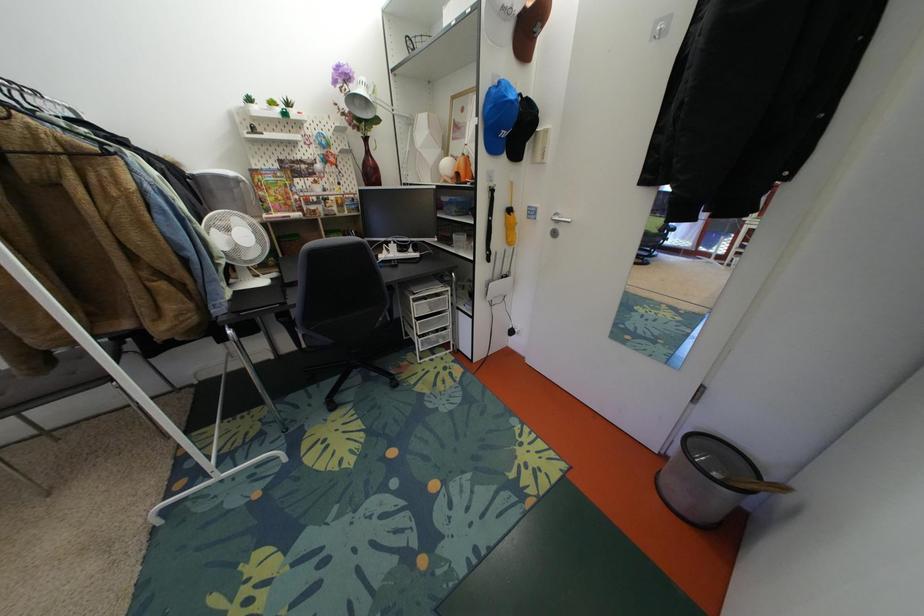
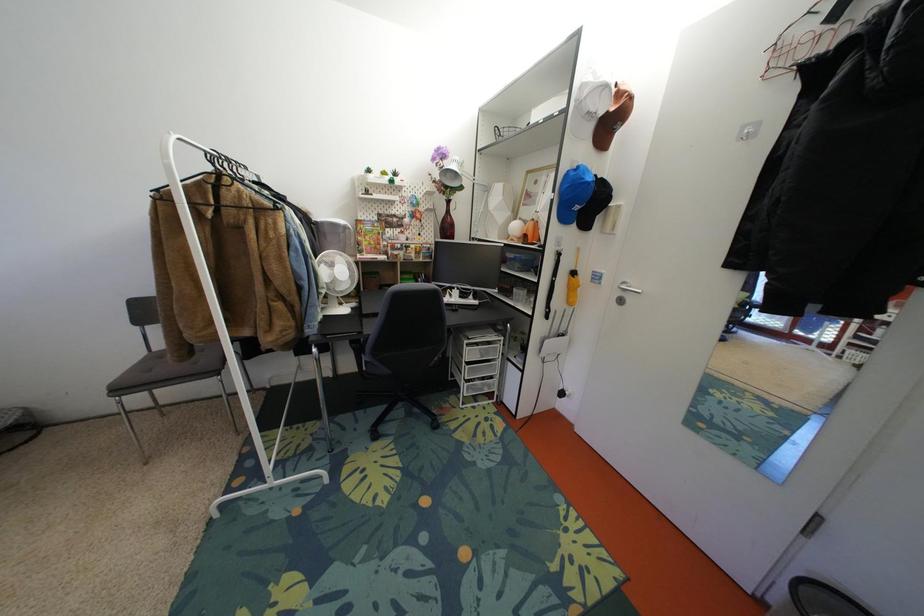
The images are taken continuously from a first-person perspective. In which direction are you moving?

The cameraman walked toward left, backward.